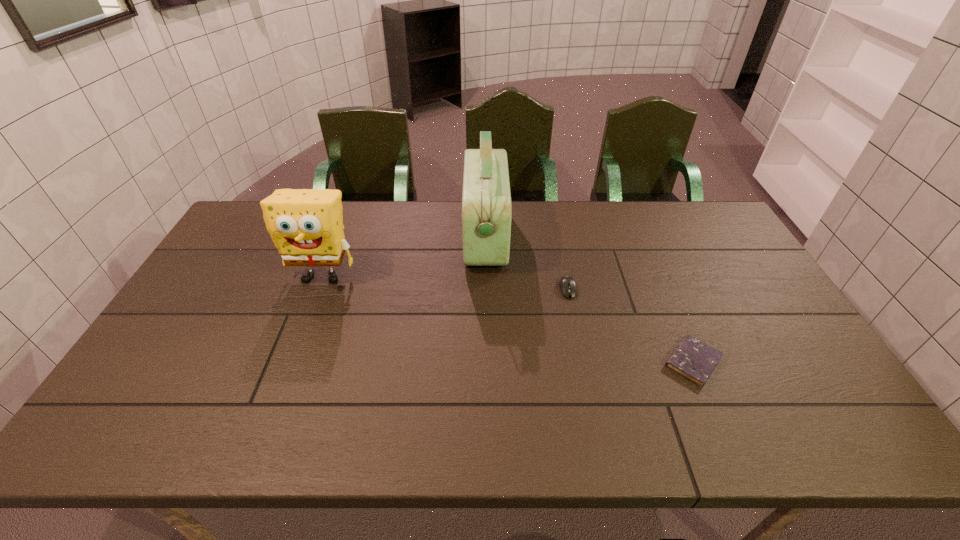
Locate an element on the screen. Image resolution: width=960 pixels, height=540 pixels. radio receiver is located at coordinates (486, 214).

Identify the location of sponge. The height and width of the screenshot is (540, 960). (306, 225).

Identify the location of the second tallest object. (306, 225).

Identify the location of computer mouse. (567, 285).

At what (x,y) coordinates should I click in order to perform the action: click on the third tallest object. Please return your answer as a coordinate pair (x, y). Image resolution: width=960 pixels, height=540 pixels. Looking at the image, I should click on (567, 285).

I want to click on the nearest object, so click(x=693, y=359).

You are a GUI agent. You are given a task and a screenshot of the screen. Output one action in this format:
    pyautogui.click(x=<x>, y=<y>)
    Task: Click on the diary
    The image size is (960, 540).
    Given the screenshot: What is the action you would take?
    pyautogui.click(x=693, y=359)

Where is `free spot located on the front panel of the radio receiver`? The width and height of the screenshot is (960, 540). free spot located on the front panel of the radio receiver is located at coordinates (398, 237).

At what (x,y) coordinates should I click in order to perform the action: click on free location located 0.380m on the front panel of the radio receiver. Please return your answer as a coordinate pair (x, y). Looking at the image, I should click on (352, 237).

The image size is (960, 540). What are the coordinates of `vacant region located 0.300m on the front panel of the radio receiver` in the screenshot? It's located at (375, 237).